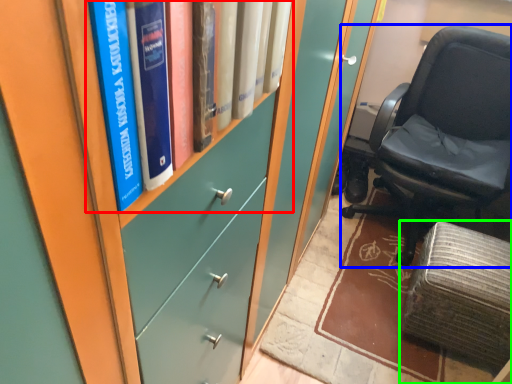
Question: Considering the real-world distances, which object is farthest from book (highlighted by a red box)? chair (highlighted by a blue box) or furniture (highlighted by a green box)?

Choices:
 (A) chair
 (B) furniture

Answer: (A)